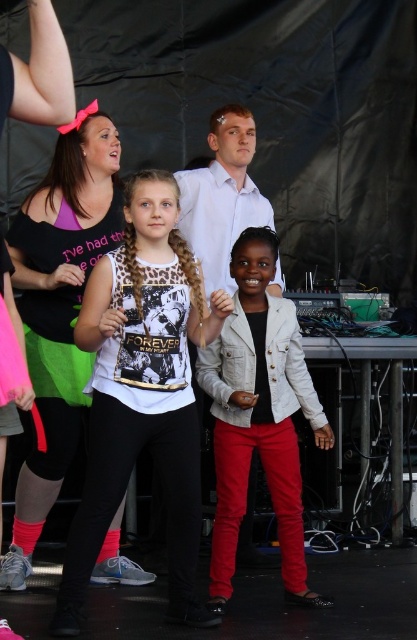
You are a photographer trying to capture a clear shot of the leopard print tank top at center and the light gray denim jacket at center. Since you want to focus on the taller object, which one should you adjust your camera to prioritize?

The leopard print tank top at center is taller than the light gray denim jacket at center, so you should adjust your camera to prioritize focusing on the leopard print tank top at center.

Looking at this image, you are a photographer trying to capture a group photo of the leopard print tank top at center and the light gray denim jacket at center. Which of the two has a wider appearance in the photo?

The leopard print tank top at center has a wider appearance than the light gray denim jacket at center in the photo because its width surpasses the latter.